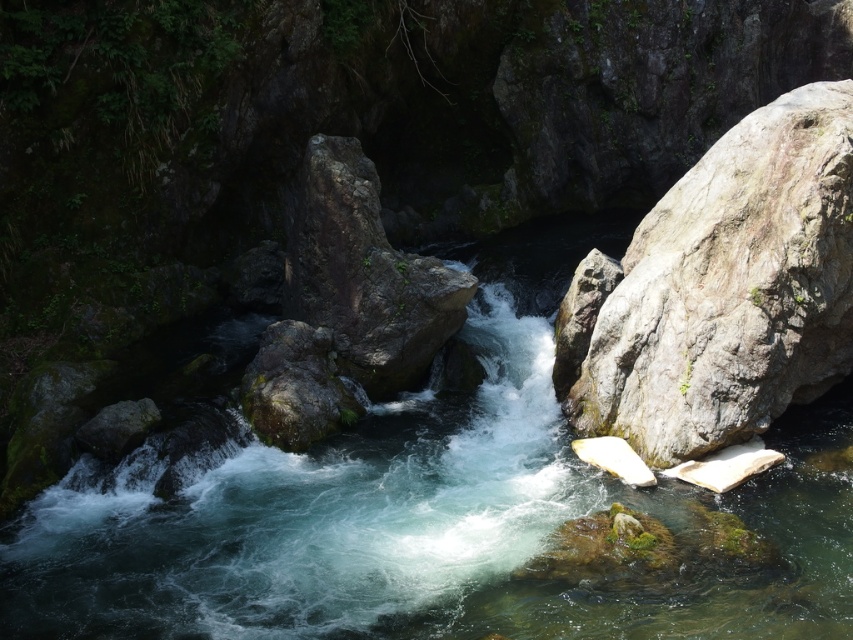
The height and width of the screenshot is (640, 853). I want to click on clear water at center, so click(422, 512).

Who is positioned more to the right, clear water at center or gray rough rock at right?

Positioned to the right is gray rough rock at right.

The height and width of the screenshot is (640, 853). What are the coordinates of `clear water at center` in the screenshot? It's located at (422, 512).